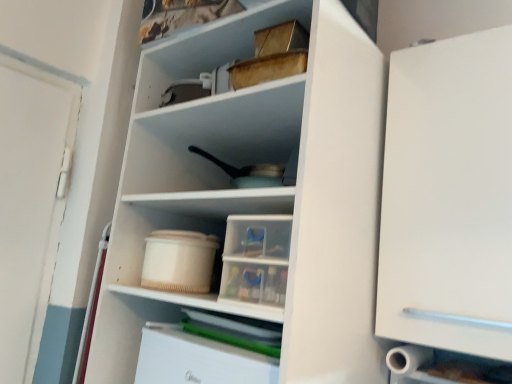
Question: Is white matte cabinet at right, which is counted as the second cabinetry, starting from the bottom, not near wooden box at upper center?

Choices:
 (A) yes
 (B) no

Answer: (B)

Question: Is white matte cabinet at right, which is the 1th cabinetry from top to bottom, bigger than wooden box at upper center?

Choices:
 (A) yes
 (B) no

Answer: (B)

Question: Can you confirm if white matte cabinet at right, marked as the second cabinetry in a left-to-right arrangement, is positioned to the right of wooden box at upper center?

Choices:
 (A) yes
 (B) no

Answer: (A)

Question: Considering the relative sizes of white matte cabinet at right, positioned as the first cabinetry in right-to-left order, and wooden box at upper center in the image provided, is white matte cabinet at right, positioned as the first cabinetry in right-to-left order, shorter than wooden box at upper center?

Choices:
 (A) yes
 (B) no

Answer: (B)

Question: From a real-world perspective, is white matte cabinet at right, which is the 1th cabinetry from top to bottom, on top of wooden box at upper center?

Choices:
 (A) yes
 (B) no

Answer: (B)

Question: Would you say white matte cabinet at right, which is the 1th cabinetry from top to bottom, contains wooden box at upper center?

Choices:
 (A) yes
 (B) no

Answer: (B)

Question: Does white plastic drawer at lower center, which is the 2th cabinetry from right to left, have a greater height compared to wooden box at upper center?

Choices:
 (A) yes
 (B) no

Answer: (B)

Question: From the image's perspective, is white plastic drawer at lower center, the 1th cabinetry when ordered from bottom to top, beneath wooden box at upper center?

Choices:
 (A) yes
 (B) no

Answer: (A)

Question: Is white plastic drawer at lower center, which is the 1th cabinetry from left to right, outside wooden box at upper center?

Choices:
 (A) no
 (B) yes

Answer: (B)

Question: Is white plastic drawer at lower center, the 1th cabinetry when ordered from bottom to top, smaller than wooden box at upper center?

Choices:
 (A) yes
 (B) no

Answer: (A)

Question: Is white plastic drawer at lower center, which is the 1th cabinetry from left to right, touching wooden box at upper center?

Choices:
 (A) yes
 (B) no

Answer: (B)

Question: Is there a large distance between white plastic drawer at lower center, the 1th cabinetry when ordered from bottom to top, and wooden box at upper center?

Choices:
 (A) no
 (B) yes

Answer: (A)

Question: Considering the relative positions of beige plastic container at center and white plastic drawer at lower center, which is the 1th cabinetry from left to right, in the image provided, is beige plastic container at center to the right of white plastic drawer at lower center, which is the 1th cabinetry from left to right, from the viewer's perspective?

Choices:
 (A) yes
 (B) no

Answer: (B)